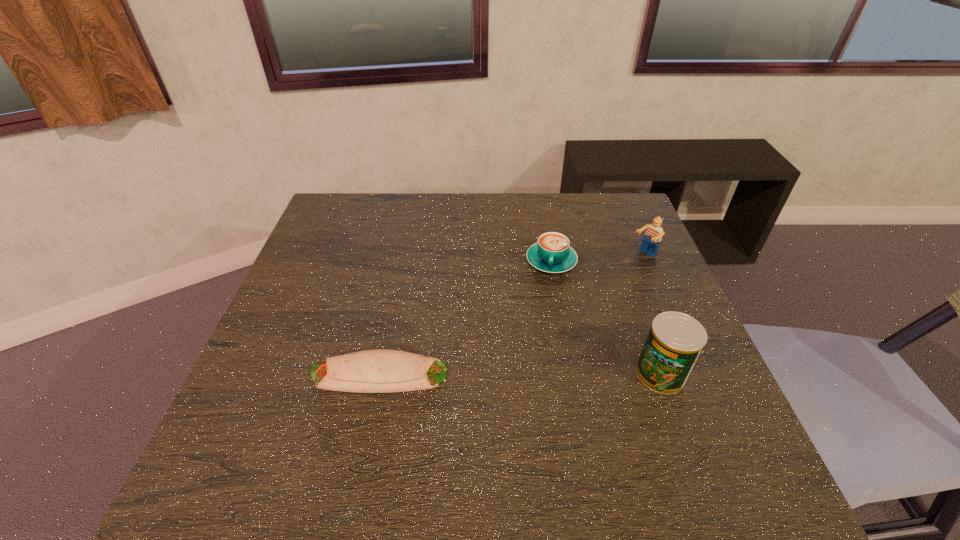
Where is `blank space at the right edge of the desktop`? The image size is (960, 540). blank space at the right edge of the desktop is located at coordinates (634, 238).

The image size is (960, 540). What are the coordinates of `vacant area at the far left corner` in the screenshot? It's located at (360, 232).

Locate an element on the screen. The width and height of the screenshot is (960, 540). free space at the near left corner is located at coordinates (295, 421).

This screenshot has width=960, height=540. What are the coordinates of `free space at the far right corner` in the screenshot? It's located at coord(620,214).

Locate an element on the screen. free spot between the second shortest object and the Lego is located at coordinates (597, 258).

Locate an element on the screen. This screenshot has width=960, height=540. free spot between the can and the third object from right to left is located at coordinates (606, 318).

Identify the location of vacant point located between the cappuccino and the tallest object. Image resolution: width=960 pixels, height=540 pixels. (606, 318).

This screenshot has height=540, width=960. In order to click on free space that is in between the cappuccino and the can in this screenshot , I will do `click(606, 318)`.

Identify the location of free space between the tallest object and the second object from left to right. (606, 318).

Find the location of a particular element. The width and height of the screenshot is (960, 540). free space between the Lego and the burrito is located at coordinates (512, 315).